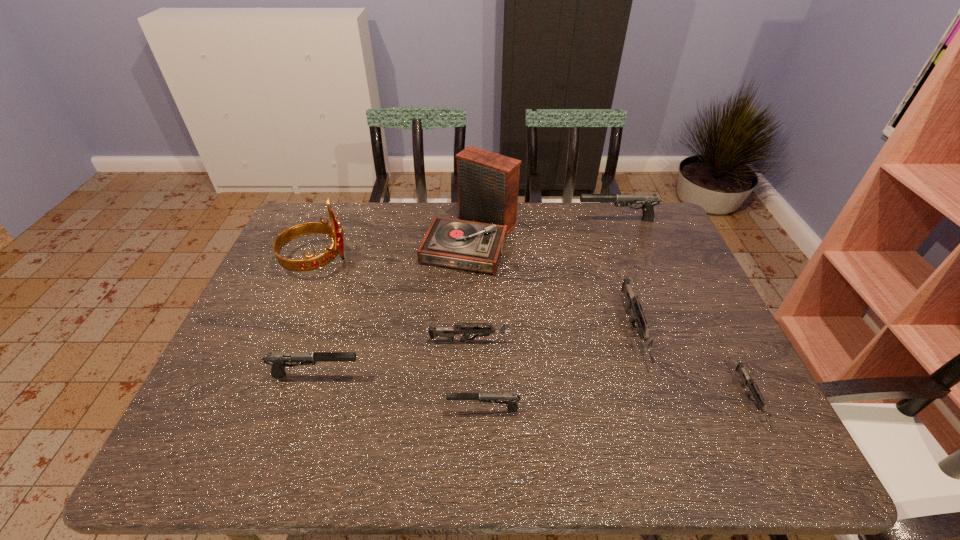
Where is `object present at the far right corner`? object present at the far right corner is located at coordinates (649, 201).

The height and width of the screenshot is (540, 960). I want to click on object located at the near right corner, so click(746, 380).

Identify the location of free location at the far edge of the desktop. (564, 242).

The image size is (960, 540). I want to click on vacant space at the near edge, so click(616, 450).

The width and height of the screenshot is (960, 540). I want to click on free location at the left edge of the desktop, so click(318, 282).

This screenshot has width=960, height=540. In the image, there is a desktop. In order to click on vacant space at the right edge in this screenshot , I will do `click(747, 390)`.

Find the location of `free space at the far left corner of the desktop`. free space at the far left corner of the desktop is located at coordinates (302, 220).

In order to click on vacant space at the near left corner in this screenshot , I will do `click(231, 445)`.

Where is `vacant space at the far right corner`? This screenshot has width=960, height=540. vacant space at the far right corner is located at coordinates (624, 207).

This screenshot has height=540, width=960. I want to click on empty location between the second grey gun from left to right and the rightmost grey gun, so click(692, 366).